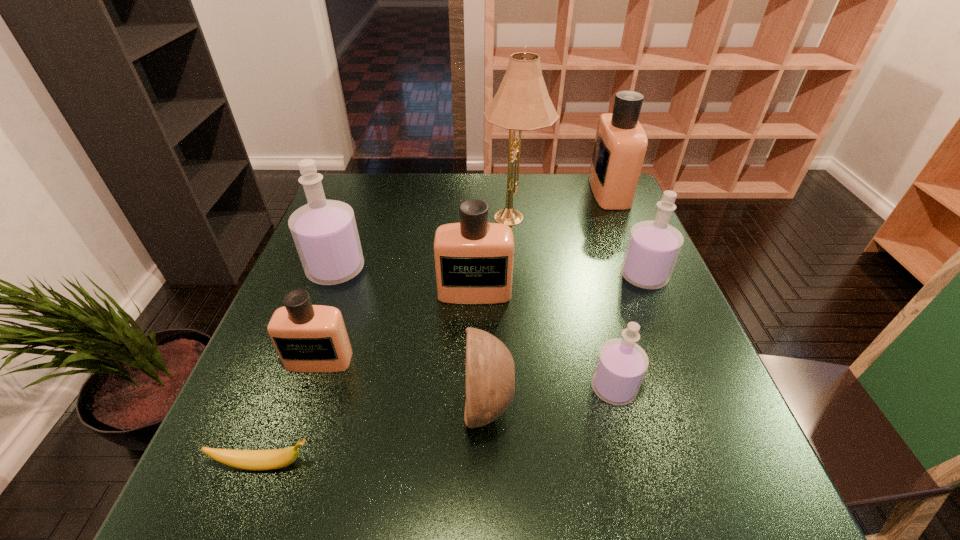
Identify which perfume is the closest to the biggest beige perfume. Please provide its 2D coordinates. Your answer should be formatted as a tuple, i.e. [(x, y)], where the tuple contains the x and y coordinates of a point satisfying the conditions above.

[(653, 247)]

You are a GUI agent. You are given a task and a screenshot of the screen. Output one action in this format:
    pyautogui.click(x=<x>, y=<y>)
    Task: Click on the beige perfume identified as the second closest to the smallest beige perfume
    This screenshot has height=540, width=960.
    Given the screenshot: What is the action you would take?
    pyautogui.click(x=620, y=146)

Choose which beige perfume is the third nearest neighbor to the seventh object from left to right. Please provide its 2D coordinates. Your answer should be formatted as a tuple, i.e. [(x, y)], where the tuple contains the x and y coordinates of a point satisfying the conditions above.

[(620, 146)]

I want to click on purple perfume that is the nearest to the biggest beige perfume, so click(653, 247).

At what (x,y) coordinates should I click in order to perform the action: click on the second closest purple perfume to the second beige perfume from left to right. Please return your answer as a coordinate pair (x, y). The height and width of the screenshot is (540, 960). Looking at the image, I should click on (621, 364).

Image resolution: width=960 pixels, height=540 pixels. I want to click on vacant area that satisfies the following two spatial constraints: 1. on the front side of the second biggest purple perfume; 2. at the stem of the nearest object, so (x=721, y=464).

This screenshot has height=540, width=960. I want to click on free space that satisfies the following two spatial constraints: 1. on the front label of the bowl; 2. on the right side of the second biggest beige perfume, so click(473, 406).

What are the coordinates of `vacant point that satisfies the following two spatial constraints: 1. on the front side of the lampshade; 2. on the right side of the nearest purple perfume` in the screenshot? It's located at (533, 388).